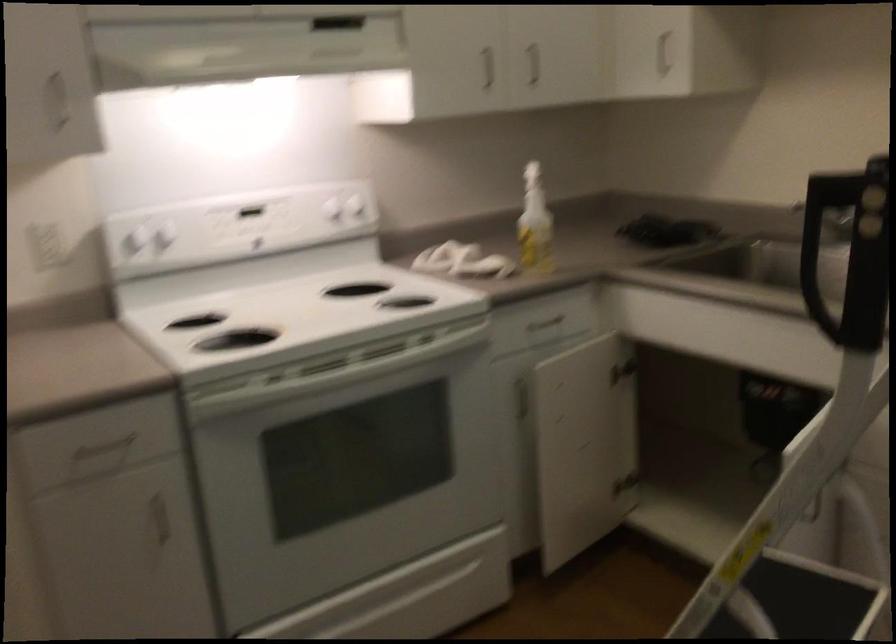
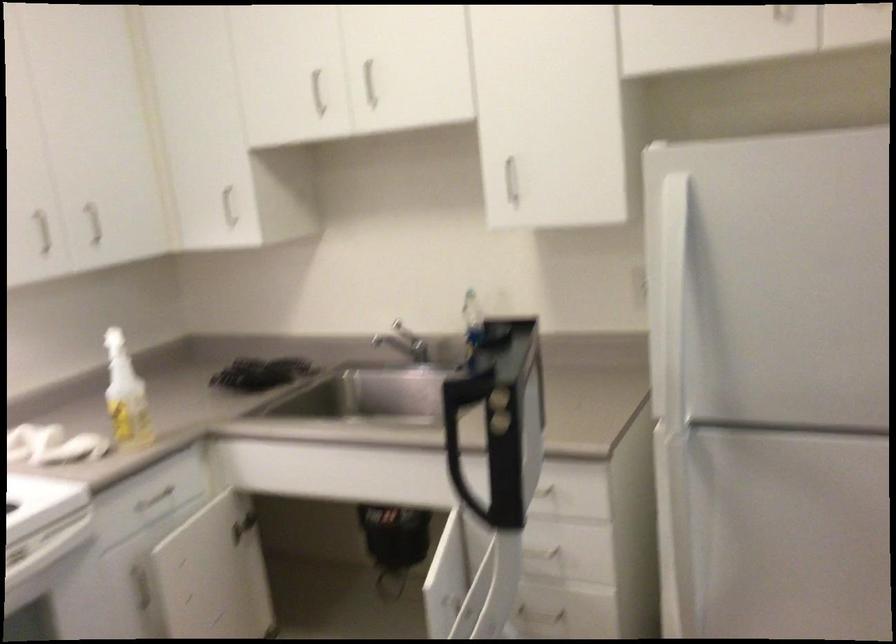
Question: Based on the continuous images, in which direction is the camera rotating? Reply with the corresponding letter.

Choices:
 (A) Left
 (B) Right
 (C) Up
 (D) Down

Answer: (B)